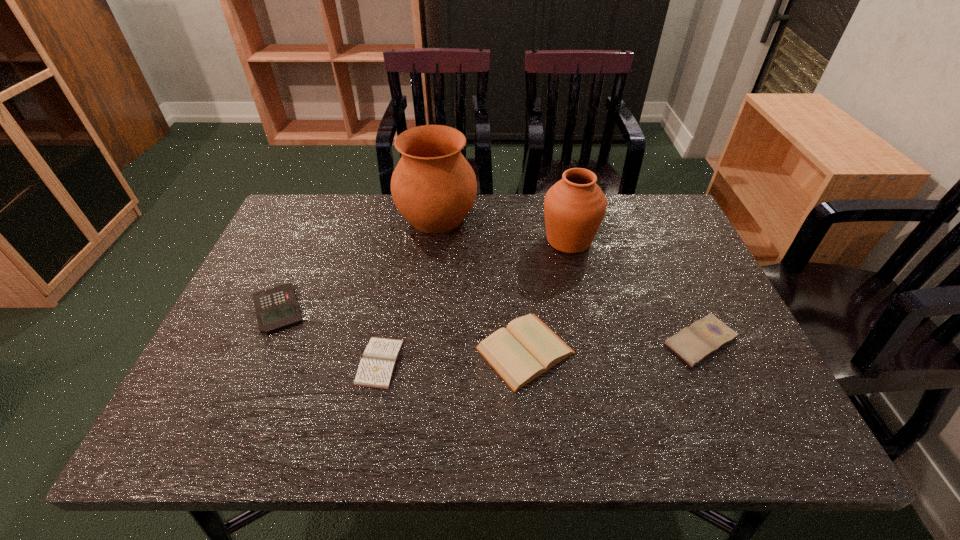
At what (x,y) coordinates should I click in order to perform the action: click on vacant region between the tallest object and the second diary from right to left. Please return your answer as a coordinate pair (x, y). This screenshot has height=540, width=960. Looking at the image, I should click on (481, 284).

What are the coordinates of `vacant area between the second tallest object and the calculator` in the screenshot? It's located at point(423,275).

The image size is (960, 540). I want to click on unoccupied area between the tallest diary and the second shortest object, so click(x=612, y=346).

Identify the location of empty location between the second diary from right to left and the fifth shortest object. The height and width of the screenshot is (540, 960). pyautogui.click(x=547, y=295).

Identify which object is the second closest to the pottery. Please provide its 2D coordinates. Your answer should be formatted as a tuple, i.e. [(x, y)], where the tuple contains the x and y coordinates of a point satisfying the conditions above.

[(276, 308)]

Locate which object is the fifth closest to the calculator. Please provide its 2D coordinates. Your answer should be formatted as a tuple, i.e. [(x, y)], where the tuple contains the x and y coordinates of a point satisfying the conditions above.

[(705, 336)]

Where is `diary that is the closest to the rightmost diary`? This screenshot has height=540, width=960. diary that is the closest to the rightmost diary is located at coordinates (526, 348).

Identify which diary is the nearest to the pottery. Please provide its 2D coordinates. Your answer should be formatted as a tuple, i.e. [(x, y)], where the tuple contains the x and y coordinates of a point satisfying the conditions above.

[(526, 348)]

This screenshot has width=960, height=540. Identify the location of free space that satisfies the following two spatial constraints: 1. on the front side of the second shortest object; 2. on the left side of the fifth shortest object. (591, 341).

Identify the location of vacant region that satisfies the following two spatial constraints: 1. on the back side of the fifth shortest object; 2. on the right side of the leftmost diary. (403, 240).